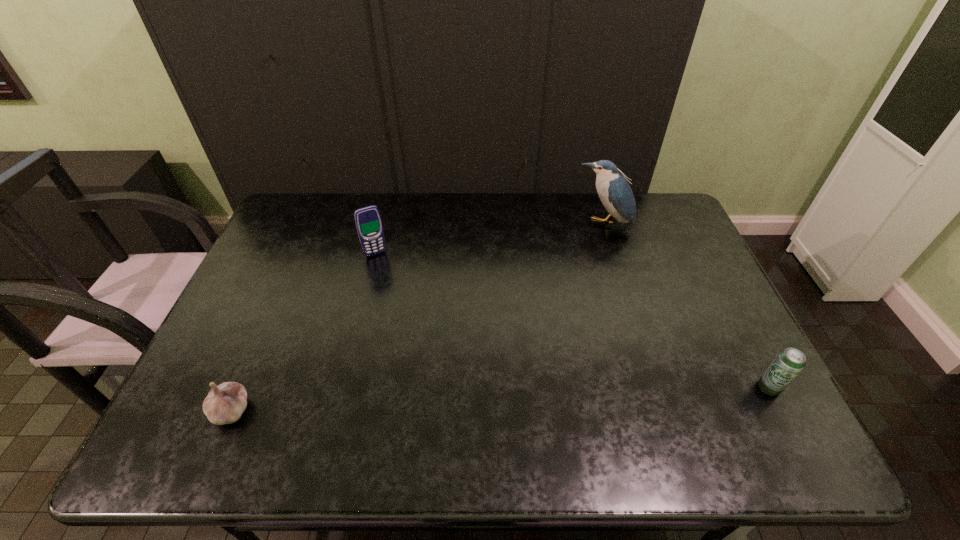
Where is `vacant area situated 0.280m on the front-facing side of the third object from right to left`? vacant area situated 0.280m on the front-facing side of the third object from right to left is located at coordinates (411, 319).

Image resolution: width=960 pixels, height=540 pixels. Find the location of `free region located 0.230m at the tip of the farthest object's beak`. free region located 0.230m at the tip of the farthest object's beak is located at coordinates (579, 279).

Where is `blank space located 0.330m at the tip of the farthest object's beak`? blank space located 0.330m at the tip of the farthest object's beak is located at coordinates (571, 302).

I want to click on vacant space located at the tip of the farthest object's beak, so click(569, 307).

This screenshot has width=960, height=540. I want to click on object that is at the far edge, so click(x=615, y=193).

This screenshot has width=960, height=540. What are the coordinates of `garlic located at the near edge` in the screenshot? It's located at (225, 403).

At what (x,y) coordinates should I click in order to perform the action: click on beer can that is at the near edge. Please return your answer as a coordinate pair (x, y). The image size is (960, 540). Looking at the image, I should click on (789, 362).

Locate an element on the screen. object at the left edge is located at coordinates (225, 403).

Identify the location of object present at the right edge. Image resolution: width=960 pixels, height=540 pixels. (789, 362).

Locate an element on the screen. object at the near left corner is located at coordinates (225, 403).